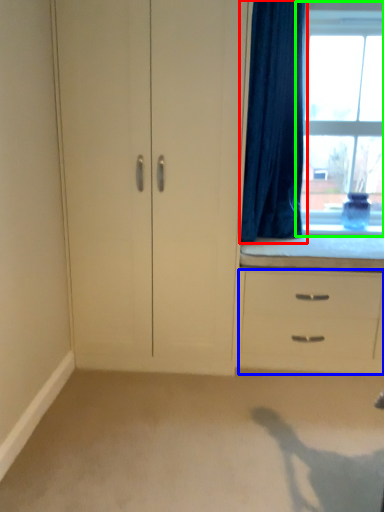
Question: Based on their relative distances, which object is farther from curtain (highlighted by a red box)? Choose from chest of drawers (highlighted by a blue box) and window (highlighted by a green box).

Choices:
 (A) chest of drawers
 (B) window

Answer: (A)